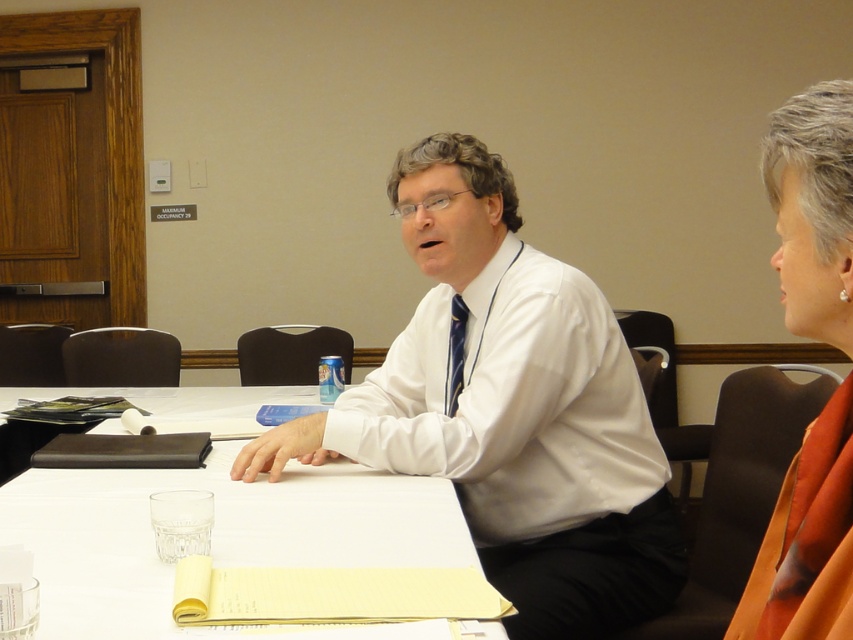
You are a security guard in the conference room and need to check the distance between the two people sitting at the table. The maximum occupancy sign says 29 people. Can you confirm if the distance between the white glossy shirt at center and the other person meets the social distancing guidelines of 6 feet apart?

The distance between the white glossy shirt at center and the other person is 4.41 feet, which is less than the required 6 feet for social distancing guidelines. Therefore, they are not maintaining the recommended distance.

You are organizing a formal event and need to ensure proper attire. Looking at the image, which item is placed lower on the person wearing the white smooth dress shirt at center and blue striped tie at center?

The white smooth dress shirt at center is positioned under the blue striped tie at center, so the dress shirt is placed lower on the person.

You are organizing a meeting in this conference room and need to place a name tag on the table. The name tag is 10 cm wide. The white glossy shirt at center and white paper at center are both on the table. Which object can the name tag be placed next to without overlapping?

The white paper at center can accommodate the name tag since the white glossy shirt at center is positioned over it, indicating the shirt is on top, so placing the name tag next to the white paper at center would avoid overlap.